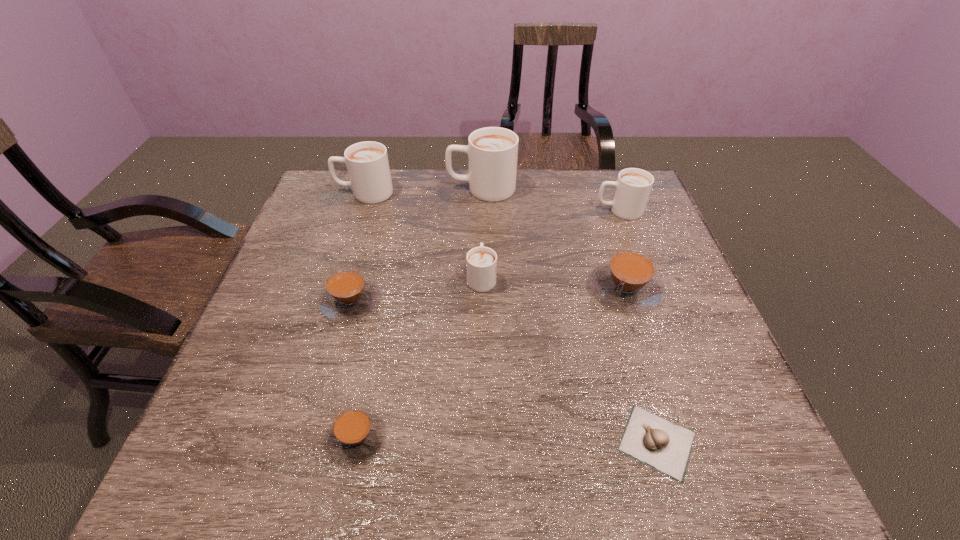
You are a GUI agent. You are given a task and a screenshot of the screen. Output one action in this format:
    pyautogui.click(x=<x>, y=<y>)
    Task: Click on the free space located 0.340m on the side with the handle of the nearest white cappuccino
    
    Given the screenshot: What is the action you would take?
    pyautogui.click(x=481, y=189)

At what (x,y) coordinates should I click in order to perform the action: click on free location located 0.060m on the side with the handle of the nearest white cappuccino. Please return your answer as a coordinate pair (x, y). Looking at the image, I should click on (482, 247).

Where is `vacant region located on the right of the second smallest brown cappuccino`? Image resolution: width=960 pixels, height=540 pixels. vacant region located on the right of the second smallest brown cappuccino is located at coordinates (514, 301).

What are the coordinates of `free spot located on the right of the smallest brown cappuccino` in the screenshot? It's located at (423, 437).

Identify the location of free space located 0.250m on the left of the shortest object. The width and height of the screenshot is (960, 540). (479, 442).

The height and width of the screenshot is (540, 960). I want to click on cappuccino positioned at the near edge, so click(356, 434).

This screenshot has width=960, height=540. I want to click on garlic present at the near edge, so (x=665, y=446).

The width and height of the screenshot is (960, 540). In order to click on garlic present at the right edge in this screenshot , I will do `click(665, 446)`.

Find the location of `object located in the far left corner section of the desktop`. object located in the far left corner section of the desktop is located at coordinates [x=367, y=163].

I want to click on object that is positioned at the far right corner, so (x=633, y=186).